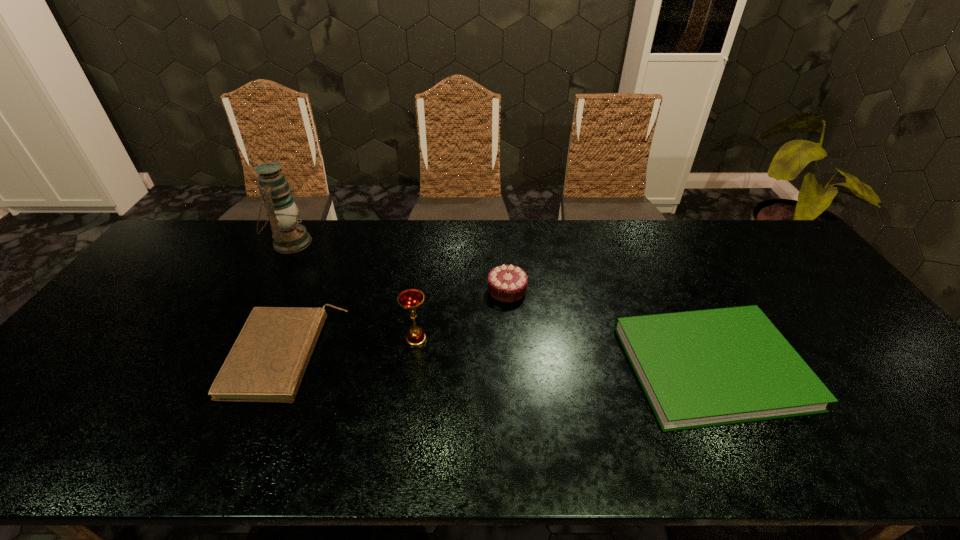
At what (x,y) coordinates should I click in order to perform the action: click on vacant space in between the fourth object from left to right and the second tallest object. Please return your answer as a coordinate pair (x, y). Looking at the image, I should click on (462, 314).

Find the location of a particular element. The height and width of the screenshot is (540, 960). unoccupied area between the third tallest object and the left paperback book is located at coordinates (397, 323).

Locate an element on the screen. The width and height of the screenshot is (960, 540). vacant space that is in between the left paperback book and the oil lamp is located at coordinates (289, 299).

Identify the location of free space between the rightmost object and the farthest object. The image size is (960, 540). (501, 305).

Identify the location of vacant space in between the farthest object and the left paperback book. The height and width of the screenshot is (540, 960). (289, 299).

This screenshot has height=540, width=960. Identify the location of vacant point located between the tallest object and the chalice. (353, 291).

Find the location of a particular element. The width and height of the screenshot is (960, 540). unoccupied position between the rightmost object and the fourth shortest object is located at coordinates (564, 353).

Where is `free spot between the chalice and the third shortest object`? free spot between the chalice and the third shortest object is located at coordinates tap(462, 314).

You are a GUI agent. You are given a task and a screenshot of the screen. Output one action in this format:
    pyautogui.click(x=<x>, y=<y>)
    Task: Click on the empty space that is in between the third tallest object and the tallest object
    This screenshot has height=540, width=960.
    Given the screenshot: What is the action you would take?
    pyautogui.click(x=398, y=266)

Find the location of `free space between the second farthest object and the left paperback book`. free space between the second farthest object and the left paperback book is located at coordinates (397, 323).